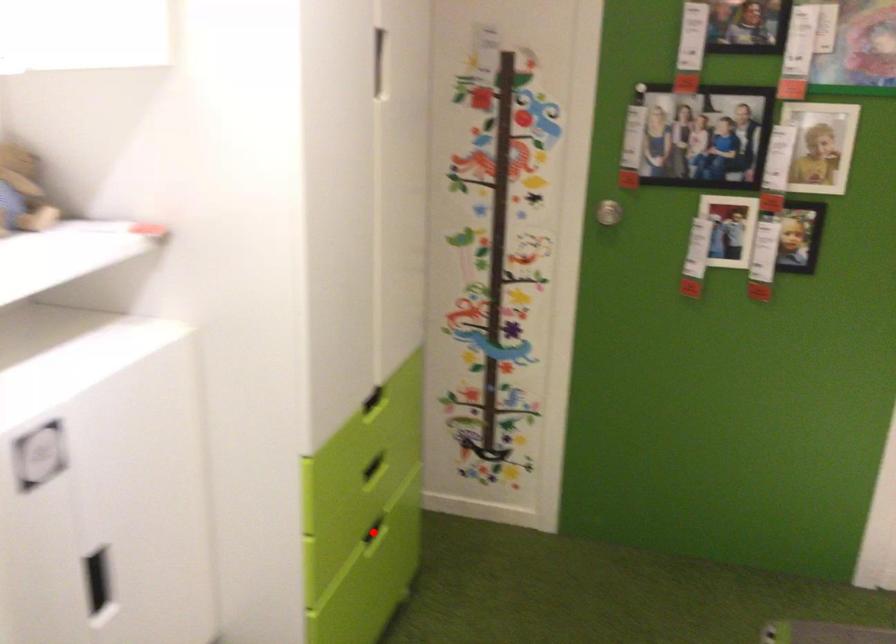
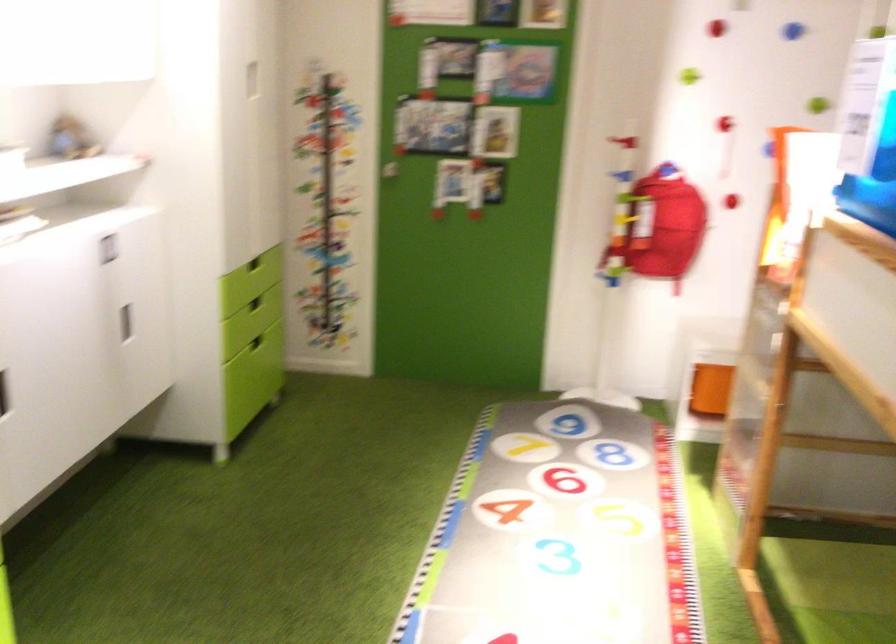
In the second image, find the point that corresponds to the highlighted location in the first image.

(255, 342)